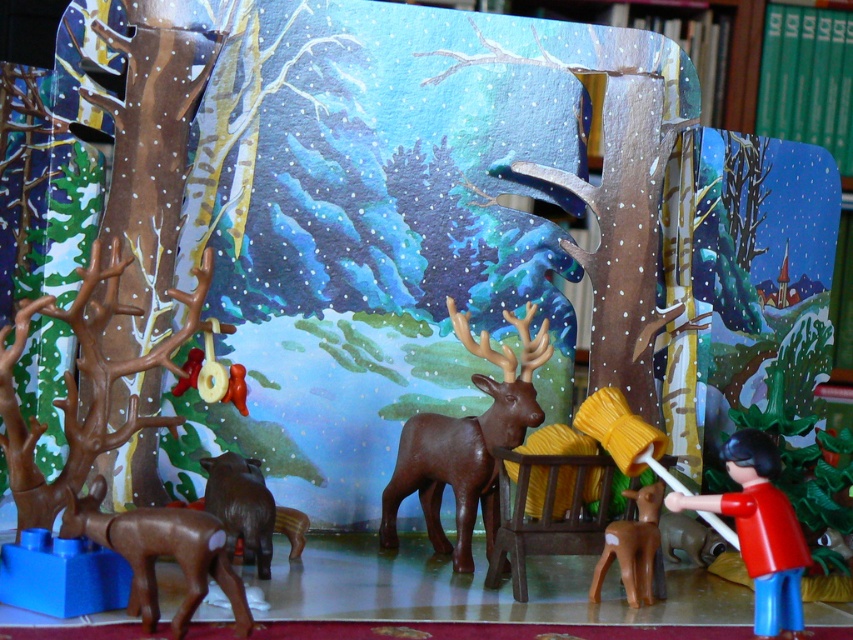
Is green hardcover book at upper right to the left of brown matte deer at lower left from the viewer's perspective?

Incorrect, green hardcover book at upper right is not on the left side of brown matte deer at lower left.

Is green hardcover book at upper right shorter than brown matte deer at lower left?

No.

Where is `green hardcover book at upper right`? The image size is (853, 640). green hardcover book at upper right is located at coordinates (807, 77).

Identify the location of brown matte deer at lower left. (160, 554).

Is brown matte deer at lower left thinner than red plastic figure at lower right?

Incorrect, brown matte deer at lower left's width is not less than red plastic figure at lower right's.

The height and width of the screenshot is (640, 853). Find the location of `brown matte deer at lower left`. brown matte deer at lower left is located at coordinates (160, 554).

This screenshot has width=853, height=640. I want to click on brown matte deer at lower left, so click(x=160, y=554).

Is brown matte deer at center bigger than brown matte deer at lower center?

Yes, brown matte deer at center is bigger than brown matte deer at lower center.

Is the position of brown matte deer at center less distant than that of brown matte deer at lower center?

That is False.

Does point (465, 468) come in front of point (643, 532)?

No, (465, 468) is behind (643, 532).

Where is `brown matte deer at center`? The image size is (853, 640). brown matte deer at center is located at coordinates (466, 444).